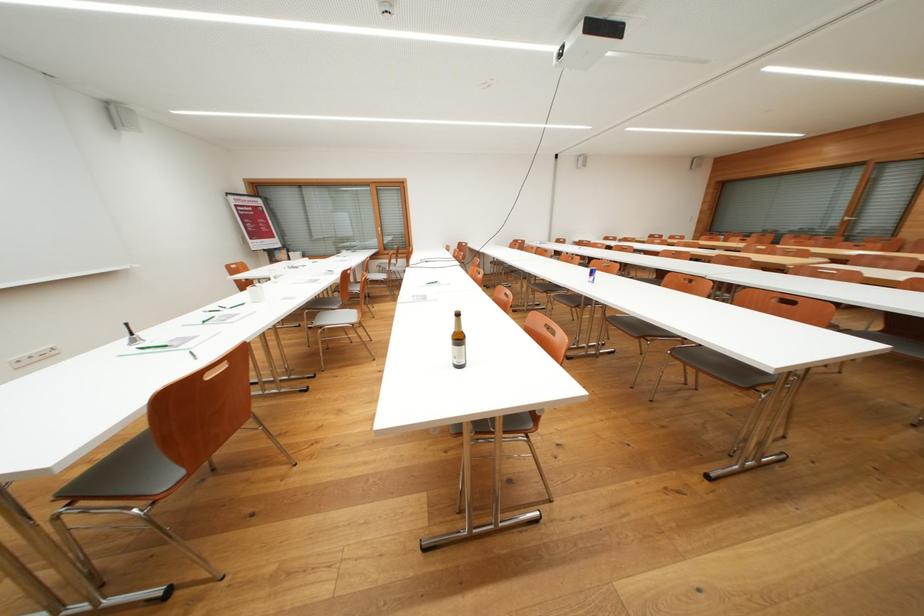
The location [457,342] corresponds to which object?

This point indicates the glass beer bottle.